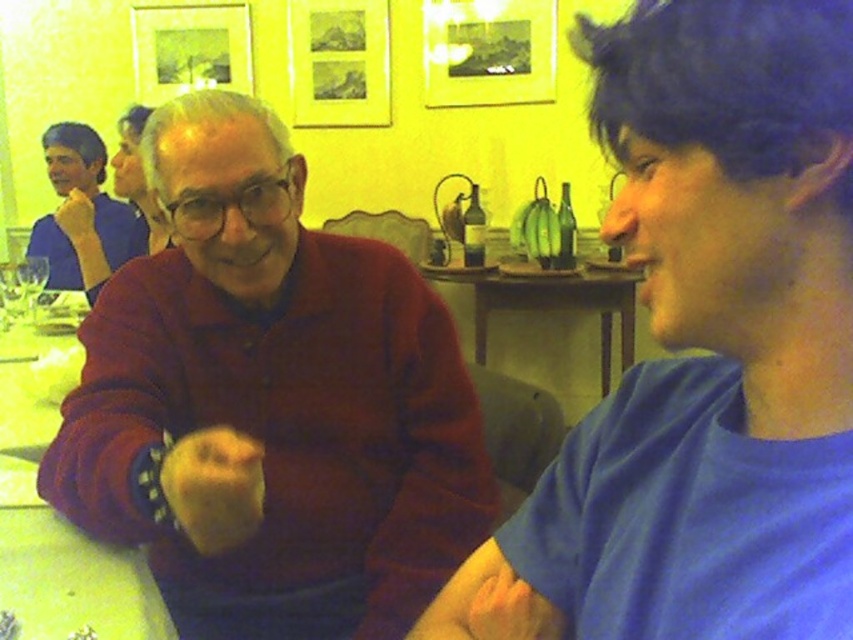
From the picture: Which of these two, matte red sweater at center or transparent plastic wine glass at lower left, stands taller?

Standing taller between the two is matte red sweater at center.

Image resolution: width=853 pixels, height=640 pixels. What do you see at coordinates (270, 403) in the screenshot? I see `matte red sweater at center` at bounding box center [270, 403].

Locate an element on the screen. matte red sweater at center is located at coordinates (270, 403).

Is matte red sweater at center to the left of wooden table at center from the viewer's perspective?

No, matte red sweater at center is not to the left of wooden table at center.

Is point (312, 253) positioned in front of point (35, 625)?

No, (312, 253) is further to viewer.

Identify the location of matte red sweater at center. (270, 403).

Who is positioned more to the left, wooden table at center or matte blue shirt at left?

matte blue shirt at left

Does wooden table at center lie in front of matte blue shirt at left?

Yes, it is.

Is point (74, 547) closer to camera compared to point (86, 150)?

That is True.

Identify the location of wooden table at center. The image size is (853, 640). (68, 570).